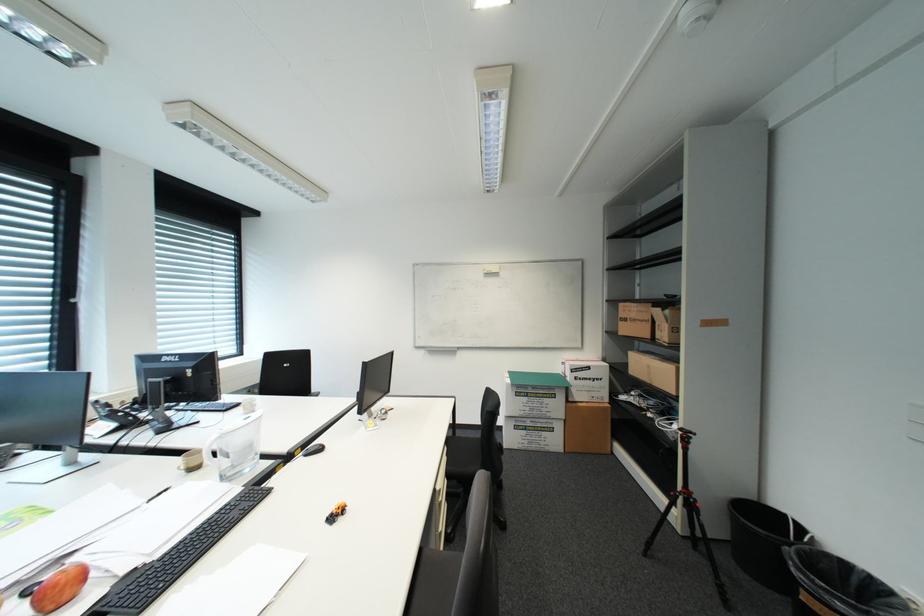
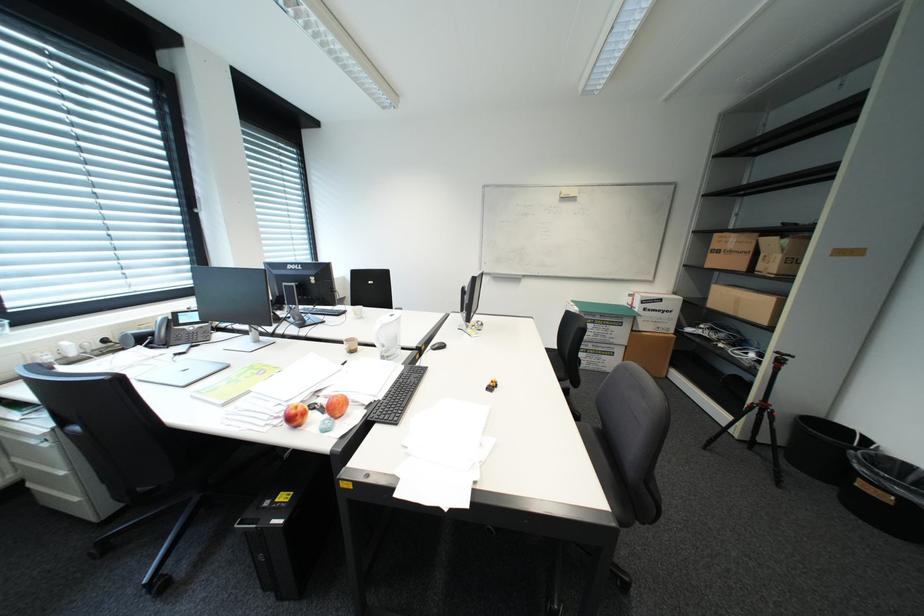
Question: Based on the continuous images, in which direction is the camera rotating? Reply with the corresponding letter.

Choices:
 (A) Left
 (B) Right
 (C) Up
 (D) Down

Answer: (D)